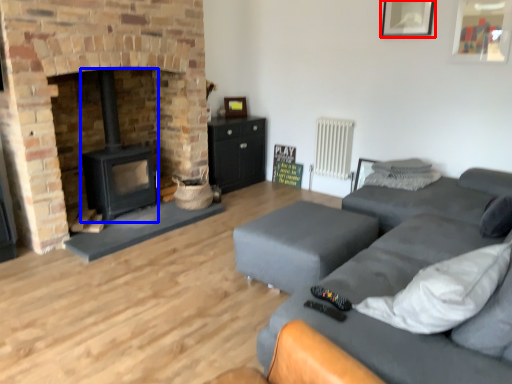
Question: Which of the following is the closest to the observer, picture frame (highlighted by a red box) or wood burning stove (highlighted by a blue box)?

Choices:
 (A) picture frame
 (B) wood burning stove

Answer: (B)